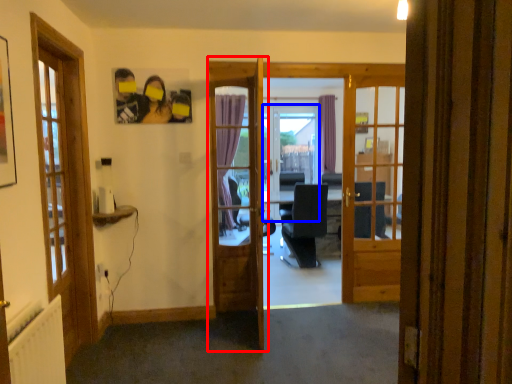
Question: Which point is closer to the camera, door (highlighted by a red box) or screen door (highlighted by a blue box)?

Choices:
 (A) door
 (B) screen door

Answer: (A)